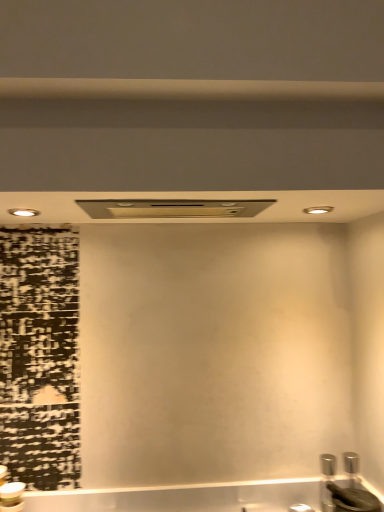
Measure the distance between point (332, 87) and camera.

Point (332, 87) and camera are 37.56 inches apart.

Describe the element at coordinates (347, 490) in the screenshot. I see `black matte sink at lower right` at that location.

The image size is (384, 512). Find the location of `satin nickel exhaust hood at center`. satin nickel exhaust hood at center is located at coordinates (173, 208).

From the image's perspective, which one is positioned higher, black matte sink at lower right or beige matte beam at upper center?

beige matte beam at upper center.

From a real-world perspective, between black matte sink at lower right and beige matte beam at upper center, who is vertically lower?

black matte sink at lower right is physically lower.

Is black matte sink at lower right outside of beige matte beam at upper center?

Indeed, black matte sink at lower right is completely outside beige matte beam at upper center.

How distant is black matte sink at lower right from beige matte beam at upper center?

They are 1.20 meters apart.

The width and height of the screenshot is (384, 512). Find the location of `exhaust hood behind the beige matte beam at upper center`. exhaust hood behind the beige matte beam at upper center is located at coordinates (173, 208).

Is beige matte beam at upper center located outside satin nickel exhaust hood at center?

Yes, beige matte beam at upper center is outside of satin nickel exhaust hood at center.

From a real-world perspective, is beige matte beam at upper center beneath satin nickel exhaust hood at center?

No, from a real-world perspective, beige matte beam at upper center is not under satin nickel exhaust hood at center.

Who is taller, beige matte beam at upper center or satin nickel exhaust hood at center?

Standing taller between the two is satin nickel exhaust hood at center.

Is satin nickel exhaust hood at center turned away from black matte sink at lower right?

satin nickel exhaust hood at center does not have its back to black matte sink at lower right.

Locate an element on the screen. Image resolution: width=384 pixels, height=512 pixels. sink behind the satin nickel exhaust hood at center is located at coordinates (347, 490).

Would you say satin nickel exhaust hood at center is inside or outside black matte sink at lower right?

The correct answer is: outside.

Considering the points (117, 87) and (368, 511), which point is in front, point (117, 87) or point (368, 511)?

The point (117, 87) is closer to the camera.

Consider the image. Can you confirm if beige matte beam at upper center is shorter than black matte sink at lower right?

Yes.

Based on the photo, can you confirm if beige matte beam at upper center is positioned to the left of black matte sink at lower right?

Yes.

Is beige matte beam at upper center far from black matte sink at lower right?

beige matte beam at upper center is far away from black matte sink at lower right.

From a real-world perspective, which object rests below the other?

From a 3D spatial view, satin nickel exhaust hood at center is below.

Is satin nickel exhaust hood at center in front of or behind beige matte beam at upper center in the image?

Visually, satin nickel exhaust hood at center is located behind beige matte beam at upper center.

In the image, there is a beige matte beam at upper center. Where is `exhaust hood below it (from the image's perspective)`? This screenshot has width=384, height=512. exhaust hood below it (from the image's perspective) is located at coordinates (173, 208).

Looking at this image, is satin nickel exhaust hood at center at the right side of beige matte beam at upper center?

No, satin nickel exhaust hood at center is not to the right of beige matte beam at upper center.

Considering the relative sizes of black matte sink at lower right and satin nickel exhaust hood at center in the image provided, is black matte sink at lower right smaller than satin nickel exhaust hood at center?

A: Indeed, black matte sink at lower right has a smaller size compared to satin nickel exhaust hood at center.

Is black matte sink at lower right outside of satin nickel exhaust hood at center?

Yes, black matte sink at lower right is outside of satin nickel exhaust hood at center.

Is black matte sink at lower right closer to the viewer compared to satin nickel exhaust hood at center?

No, it is not.

The width and height of the screenshot is (384, 512). I want to click on beam on the left side of black matte sink at lower right, so click(188, 89).

The width and height of the screenshot is (384, 512). I want to click on exhaust hood below the beige matte beam at upper center (from the image's perspective), so click(173, 208).

Consider the image. When comparing their distances from beige matte beam at upper center, does black matte sink at lower right or satin nickel exhaust hood at center seem closer?

Among the two, satin nickel exhaust hood at center is located nearer to beige matte beam at upper center.

Based on their spatial positions, is satin nickel exhaust hood at center or beige matte beam at upper center further from black matte sink at lower right?

The object further to black matte sink at lower right is beige matte beam at upper center.

Which object lies further to the anchor point satin nickel exhaust hood at center, beige matte beam at upper center or black matte sink at lower right?

The object further to satin nickel exhaust hood at center is black matte sink at lower right.

Based on their spatial positions, is black matte sink at lower right or beige matte beam at upper center further from satin nickel exhaust hood at center?

The object further to satin nickel exhaust hood at center is black matte sink at lower right.

Based on their spatial positions, is beige matte beam at upper center or satin nickel exhaust hood at center further from black matte sink at lower right?

Based on the image, beige matte beam at upper center appears to be further to black matte sink at lower right.

Which object lies further to the anchor point beige matte beam at upper center, satin nickel exhaust hood at center or black matte sink at lower right?

black matte sink at lower right lies further to beige matte beam at upper center than the other object.

The height and width of the screenshot is (512, 384). In order to click on exhaust hood between beige matte beam at upper center and black matte sink at lower right from top to bottom in this screenshot , I will do `click(173, 208)`.